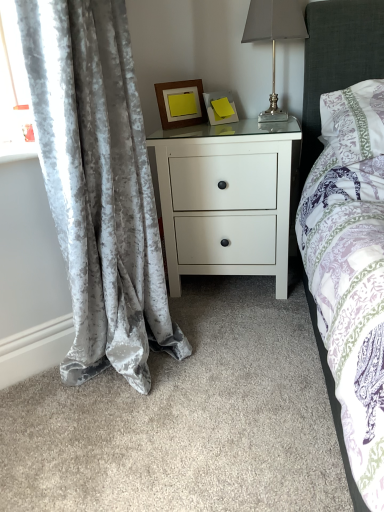
Question: In the image, is matte yellow picture frame at upper center, placed as the 1th picture frame when sorted from right to left, on the left side or the right side of white matte nightstand at center?

Choices:
 (A) left
 (B) right

Answer: (A)

Question: Is matte yellow picture frame at upper center, placed as the 1th picture frame when sorted from right to left, inside or outside of white matte nightstand at center?

Choices:
 (A) outside
 (B) inside

Answer: (A)

Question: Which object is positioned farthest from the matte yellow picture frame at upper center, the 2th picture frame in the left-to-right sequence?

Choices:
 (A) wooden frame at upper center, the 2th picture frame in the right-to-left sequence
 (B) white floral fabric pillow at upper right
 (C) metallic silver table lamp at upper right
 (D) velvet gray curtain at left
 (E) white matte nightstand at center

Answer: (D)

Question: Estimate the real-world distances between objects in this image. Which object is closer to the velvet gray curtain at left?

Choices:
 (A) white matte nightstand at center
 (B) matte yellow picture frame at upper center, the 2th picture frame in the left-to-right sequence
 (C) white floral fabric pillow at upper right
 (D) metallic silver table lamp at upper right
 (E) wooden frame at upper center, marked as the first picture frame in a left-to-right arrangement

Answer: (A)